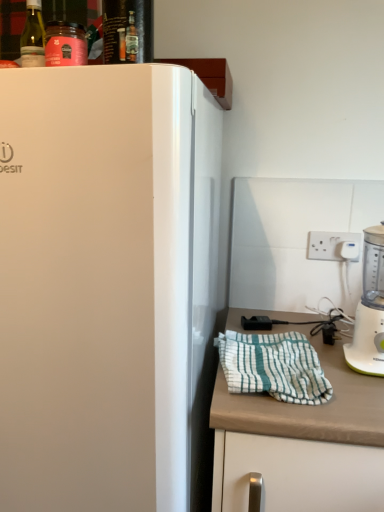
Question: Is point (302, 408) closer or farther from the camera than point (112, 242)?

Choices:
 (A) farther
 (B) closer

Answer: (A)

Question: From the image's perspective, is white matte countertop at lower right above or below white glossy refrigerator at left?

Choices:
 (A) below
 (B) above

Answer: (A)

Question: Based on their relative distances, which object is nearer to the white plastic blender at right?

Choices:
 (A) white glossy refrigerator at left
 (B) green glass bottle at upper left
 (C) shiny glass bottle at upper center
 (D) white matte countertop at lower right
 (E) white plastic electric outlet at upper right

Answer: (D)

Question: Which object is the farthest from the white plastic blender at right?

Choices:
 (A) shiny glass bottle at upper center
 (B) white plastic electric outlet at upper right
 (C) white striped cloth at lower right
 (D) green glass bottle at upper left
 (E) white matte countertop at lower right

Answer: (D)